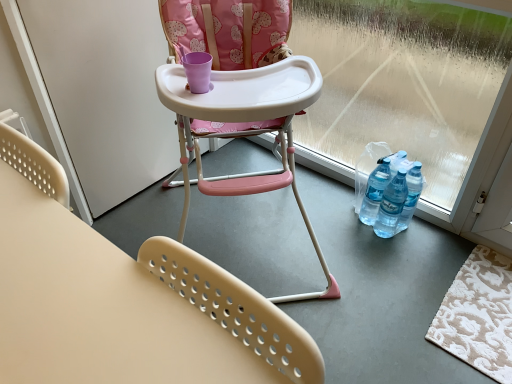
Identify the location of free location in front of transparent plastic window screen at lower right. (397, 277).